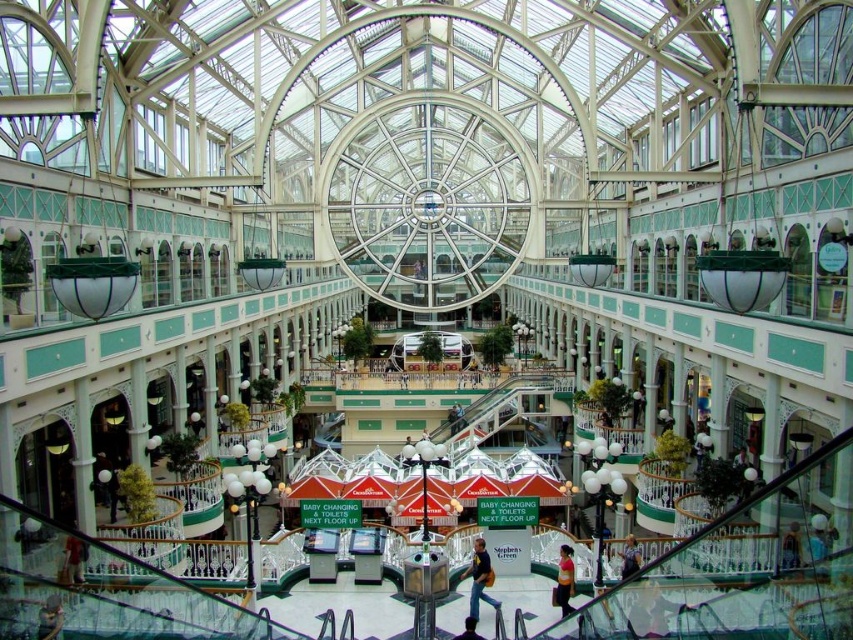
Question: Which object appears closest to the camera in this image?

Choices:
 (A) matte pink shirt at center
 (B) jeans at center
 (C) blue denim jeans at lower center

Answer: (B)

Question: Considering the relative positions of jeans at center and blue denim jeans at lower center in the image provided, where is jeans at center located with respect to blue denim jeans at lower center?

Choices:
 (A) below
 (B) above

Answer: (A)

Question: Which of the following is the closest to the observer?

Choices:
 (A) matte pink shirt at center
 (B) jeans at center

Answer: (B)

Question: Is jeans at center further to camera compared to matte pink shirt at center?

Choices:
 (A) no
 (B) yes

Answer: (A)

Question: Which point is closer to the camera?

Choices:
 (A) matte pink shirt at center
 (B) jeans at center
 (C) blue denim jeans at lower center

Answer: (B)

Question: From the image, what is the correct spatial relationship of jeans at center in relation to matte pink shirt at center?

Choices:
 (A) below
 (B) above

Answer: (A)